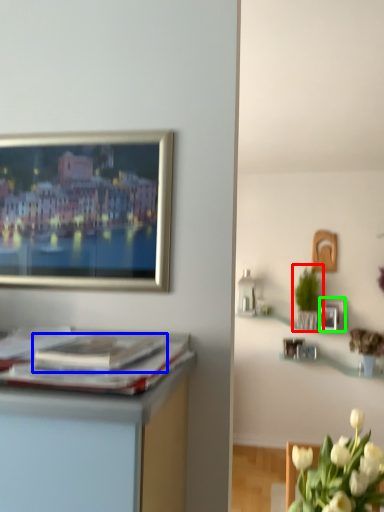
Question: Based on their relative distances, which object is nearer to houseplant (highlighted by a red box)? Choose from magazine (highlighted by a blue box) and picture frame (highlighted by a green box).

Choices:
 (A) magazine
 (B) picture frame

Answer: (B)